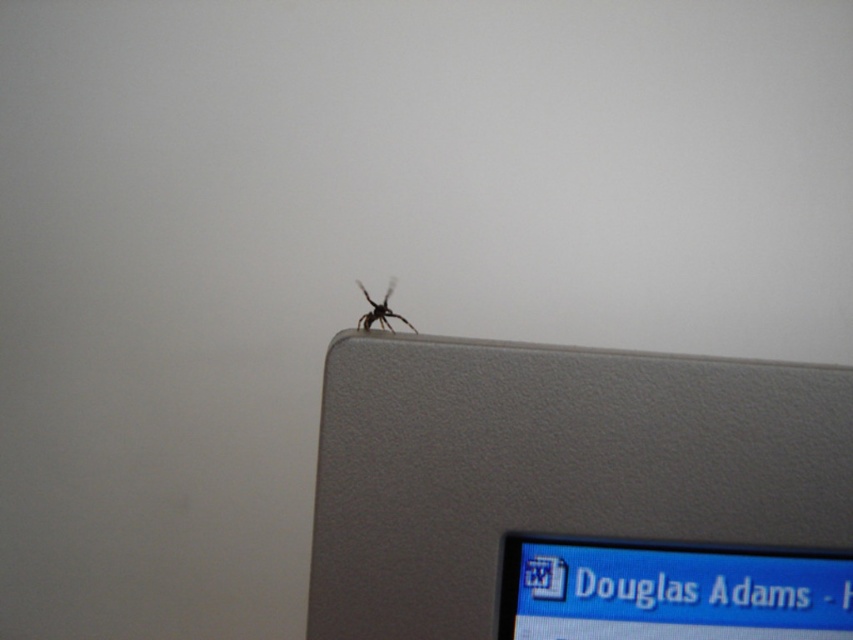
You are a small insect trying to climb onto the satin silver laptop at upper right and the matte gray computer monitor at upper right. Which one is easier to reach from your current position?

The satin silver laptop at upper right is closer to the viewer than the matte gray computer monitor at upper right, so it is easier to reach.

You are a technician trying to fix a computer. You see a spider on a screen. Which object is the spider on? The satin silver laptop at upper right or the matte gray computer monitor at upper right?

The spider is on the matte gray computer monitor at upper right because the satin silver laptop at upper right is to the left of it, meaning the monitor is on the right side where the spider is located.

You are a graphic designer working on a project and need to place a new icon on your laptop screen. The icon must be placed exactly at the point marked by the coordinates point (549, 465). However, there is a spider currently located at the upper right corner of the screen. Will placing the icon at this point interfere with the spider?

The point (549, 465) indicates the location of the satin silver laptop at upper right, so placing the icon there would interfere with the spider since it is already at that location.